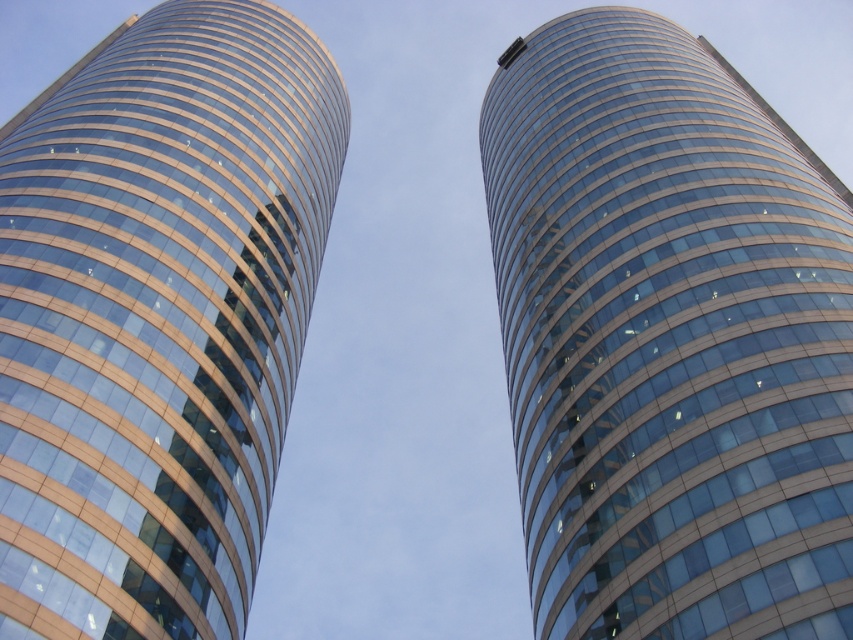
In the scene shown: Can you confirm if glassy blue skyscraper at center is smaller than matte glass building at center?

Correct, glassy blue skyscraper at center occupies less space than matte glass building at center.

Can you confirm if glassy blue skyscraper at center is thinner than matte glass building at center?

Indeed, glassy blue skyscraper at center has a lesser width compared to matte glass building at center.

Is point (592, 614) closer to camera compared to point (235, 141)?

Yes.

Identify the location of glassy blue skyscraper at center. (669, 339).